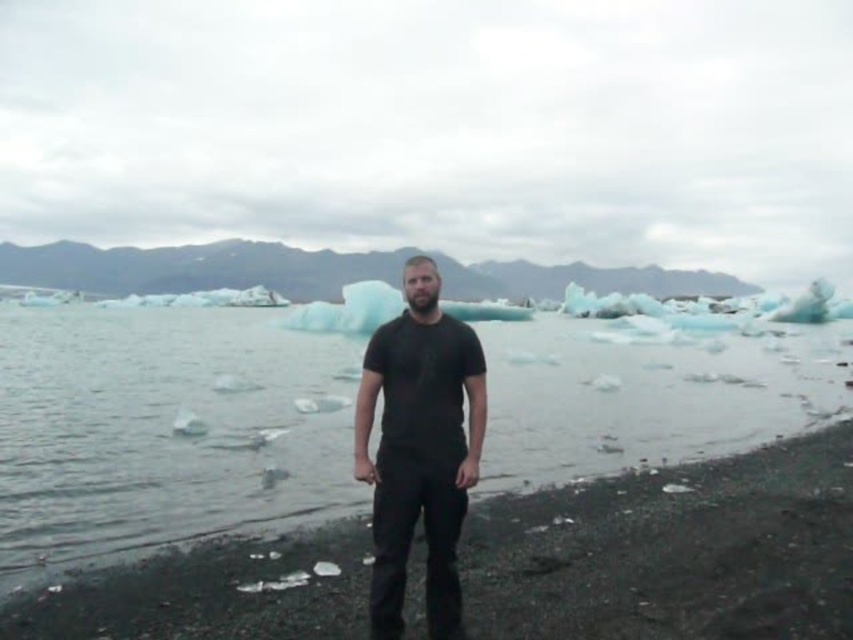
Which is in front, point (143, 541) or point (422, 388)?

Positioned in front is point (422, 388).

Who is positioned more to the left, clear ice water at center or black matte shirt at center?

From the viewer's perspective, clear ice water at center appears more on the left side.

Who is more distant from viewer, (234, 502) or (392, 632)?

Point (234, 502)

The height and width of the screenshot is (640, 853). What are the coordinates of `clear ice water at center` in the screenshot? It's located at (164, 432).